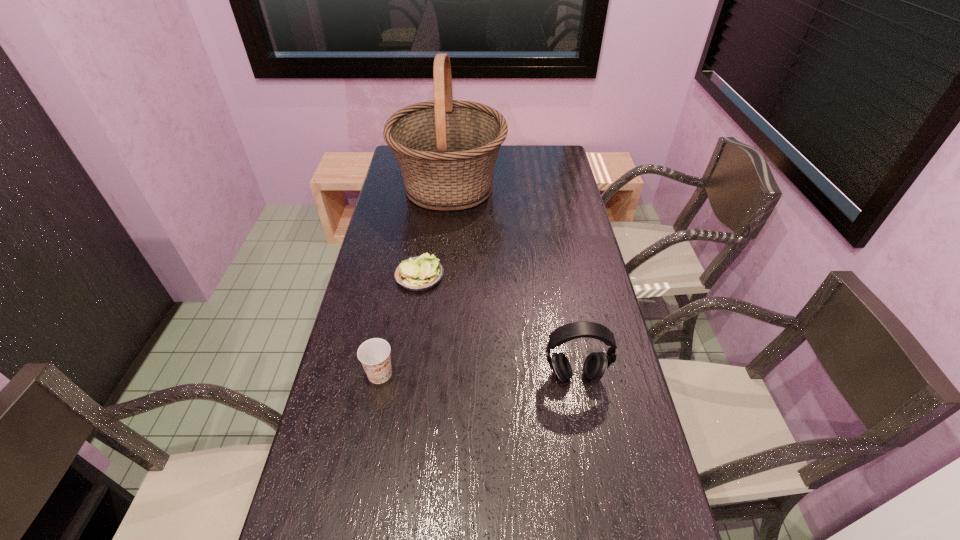
I want to click on the tallest object, so click(x=446, y=149).

Where is `the farthest object`? This screenshot has width=960, height=540. the farthest object is located at coordinates (446, 149).

Where is `earphone`? earphone is located at coordinates (595, 365).

Where is `the rightmost object`? the rightmost object is located at coordinates (595, 365).

Identify the location of the third tallest object. The width and height of the screenshot is (960, 540). (374, 354).

Where is `the third nearest object`? the third nearest object is located at coordinates (419, 273).

You are a GUI agent. You are given a task and a screenshot of the screen. Output one action in this format:
    pyautogui.click(x=<x>, y=<y>)
    Task: Click on the lettuce
    The height and width of the screenshot is (540, 960).
    Given the screenshot: What is the action you would take?
    pyautogui.click(x=419, y=273)

The image size is (960, 540). Find the location of `vacant area situated on the right of the tallest object`. vacant area situated on the right of the tallest object is located at coordinates (565, 187).

Locate an element on the screen. The width and height of the screenshot is (960, 540). free location located on the ear cups of the second tallest object is located at coordinates (603, 534).

Identify the location of free space located on the back of the Dixie cup. (388, 329).